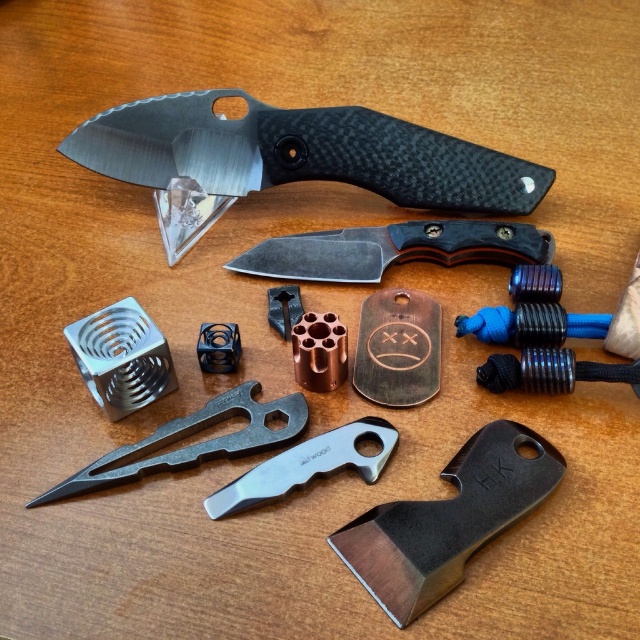
Question: Does stainless steel hatchet at center appear on the right side of matte metal multi-tool at center?

Choices:
 (A) yes
 (B) no

Answer: (A)

Question: Can you confirm if matte black knife at upper center is positioned above silver metallic pocket knife at center?

Choices:
 (A) no
 (B) yes

Answer: (B)

Question: Which object is farther from the camera taking this photo?

Choices:
 (A) silver metallic pocket knife at center
 (B) stainless steel hatchet at center

Answer: (A)

Question: Does dark gray metal knife at center have a smaller size compared to silver metallic pocket knife at center?

Choices:
 (A) yes
 (B) no

Answer: (B)

Question: Which of these objects is positioned farthest from the stainless steel hatchet at center?

Choices:
 (A) matte metal multi-tool at center
 (B) matte black knife at upper center
 (C) dark gray metal knife at center

Answer: (B)

Question: Which of the following is the farthest from the observer?

Choices:
 (A) (490, 241)
 (B) (88, 490)
 (C) (484, 512)
 (D) (275, 472)

Answer: (A)